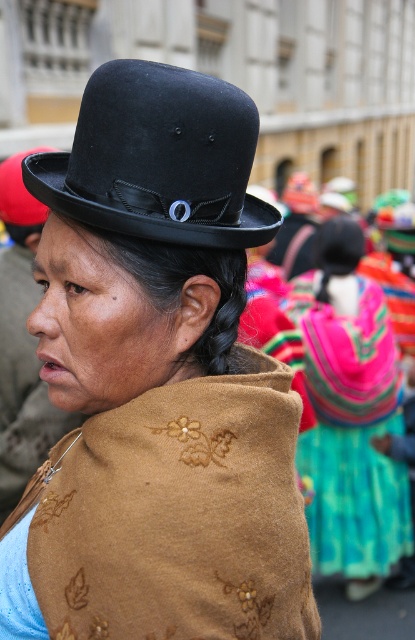
You are standing in front of the woman in the image and want to place a small decoration. You have two points to choose from. The first point is at coordinate point(126,624) and the second is at point(139,198). Which point is closer to you?

Point(126,624) is closer to the viewer than point(139,198).

You are taking a photo of the scene and want to focus on both point (143,147) and point (315,464). Which point is closer to your camera lens?

Point (143,147) is closer to the camera lens than point (315,464).

You are a photographer adjusting your camera settings to capture the scene. The matte black hat at upper center is located at point (158, 380). You want to ensure the hat is in focus while also capturing the vibrant background. Which part of the scene should you focus on to achieve this?

You should focus on the matte black hat at upper center located at point (158, 380) to ensure it is in focus, and use a shallow depth of field to blur the background slightly while still capturing its vibrant colors.